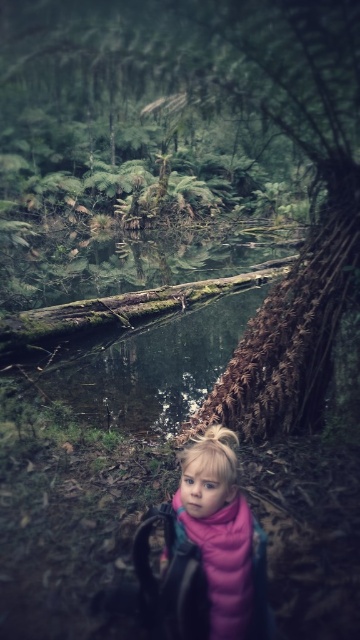
You are a photographer trying to capture the pink fleece jacket at center and the brown textured log at center in the same frame. Based on their positions, which object is located to the left of the other?

The brown textured log at center is positioned on the right side of pink fleece jacket at center, so the pink fleece jacket at center is to the left of the brown textured log at center.

You are a photographer trying to capture the child in the scene. Since you want to focus on the child, which object should you avoid placing in the foreground to prevent blocking the view? Please choose between the brown textured log at center and the pink fleece jacket at center.

The brown textured log at center is bigger than the pink fleece jacket at center, so you should avoid placing the brown textured log at center in the foreground as it might block the view of the child more significantly.